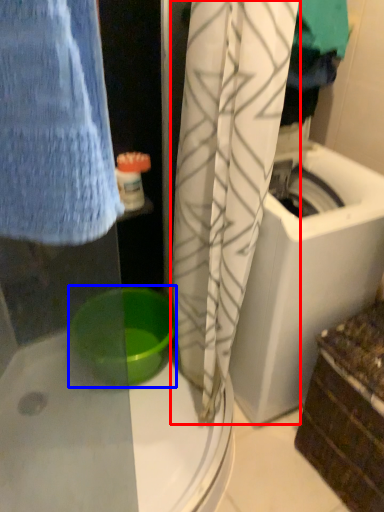
Question: Which object appears farthest to the camera in this image, curtain (highlighted by a red box) or basin (highlighted by a blue box)?

Choices:
 (A) curtain
 (B) basin

Answer: (B)